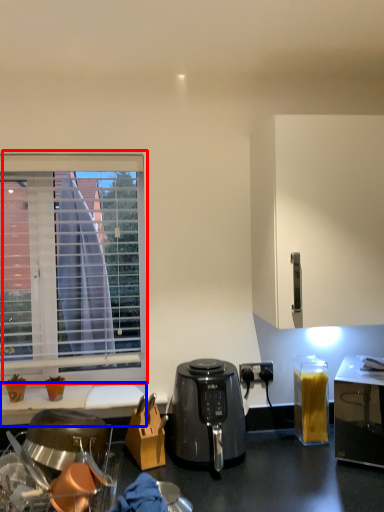
Question: Which object is closer to the camera taking this photo, window (highlighted by a red box) or desk (highlighted by a blue box)?

Choices:
 (A) window
 (B) desk

Answer: (B)